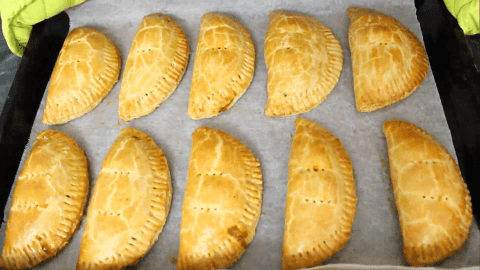
This screenshot has width=480, height=270. In order to click on counter in this screenshot , I will do `click(11, 70)`.